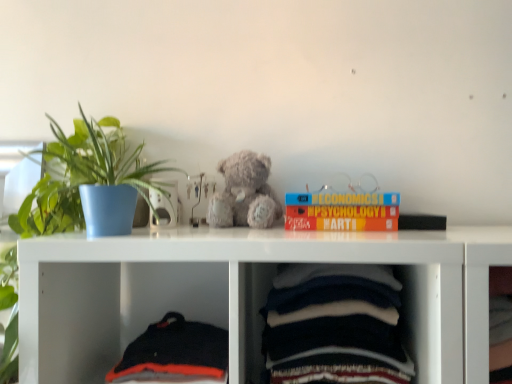
Question: Does dark blue cotton baby clothes at lower center, the first baby clothe positioned from the right, have a smaller size compared to black matte book at upper right, marked as the first book in a right-to-left arrangement?

Choices:
 (A) yes
 (B) no

Answer: (B)

Question: Considering the relative positions of dark blue cotton baby clothes at lower center, the 2th baby clothe positioned from the left, and black matte book at upper right, which is counted as the 2th book, starting from the left, in the image provided, is dark blue cotton baby clothes at lower center, the 2th baby clothe positioned from the left, in front of black matte book at upper right, which is counted as the 2th book, starting from the left,?

Choices:
 (A) yes
 (B) no

Answer: (A)

Question: Could black matte book at upper right, which is counted as the 2th book, starting from the left, be considered to be inside dark blue cotton baby clothes at lower center, the 2th baby clothe positioned from the left?

Choices:
 (A) yes
 (B) no

Answer: (B)

Question: Is dark blue cotton baby clothes at lower center, the 2th baby clothe positioned from the left, to the left of black matte book at upper right, which is counted as the 2th book, starting from the left, from the viewer's perspective?

Choices:
 (A) yes
 (B) no

Answer: (A)

Question: Considering the relative positions of dark blue cotton baby clothes at lower center, the 2th baby clothe positioned from the left, and black matte book at upper right, which is counted as the 2th book, starting from the left, in the image provided, is dark blue cotton baby clothes at lower center, the 2th baby clothe positioned from the left, to the right of black matte book at upper right, which is counted as the 2th book, starting from the left, from the viewer's perspective?

Choices:
 (A) yes
 (B) no

Answer: (B)

Question: Does dark blue cotton baby clothes at lower center, the first baby clothe positioned from the right, have a lesser width compared to black matte book at upper right, which is counted as the 2th book, starting from the left?

Choices:
 (A) yes
 (B) no

Answer: (B)

Question: Are fuzzy gray teddy bear at center and black cotton sweater at lower left, the 2th baby clothe viewed from the right, located far from each other?

Choices:
 (A) no
 (B) yes

Answer: (A)

Question: From the image's perspective, is fuzzy gray teddy bear at center above black cotton sweater at lower left, the 2th baby clothe viewed from the right?

Choices:
 (A) yes
 (B) no

Answer: (A)

Question: Considering the relative sizes of fuzzy gray teddy bear at center and black cotton sweater at lower left, the first baby clothe positioned from the left, in the image provided, is fuzzy gray teddy bear at center bigger than black cotton sweater at lower left, the first baby clothe positioned from the left,?

Choices:
 (A) yes
 (B) no

Answer: (B)

Question: Does fuzzy gray teddy bear at center appear on the right side of black cotton sweater at lower left, the first baby clothe positioned from the left?

Choices:
 (A) yes
 (B) no

Answer: (A)

Question: Is fuzzy gray teddy bear at center smaller than black cotton sweater at lower left, the first baby clothe positioned from the left?

Choices:
 (A) yes
 (B) no

Answer: (A)

Question: Considering the relative positions of fuzzy gray teddy bear at center and black cotton sweater at lower left, the first baby clothe positioned from the left, in the image provided, is fuzzy gray teddy bear at center in front of black cotton sweater at lower left, the first baby clothe positioned from the left,?

Choices:
 (A) no
 (B) yes

Answer: (A)

Question: Can you confirm if black cotton sweater at lower left, the first baby clothe positioned from the left, is bigger than fuzzy gray teddy bear at center?

Choices:
 (A) no
 (B) yes

Answer: (B)